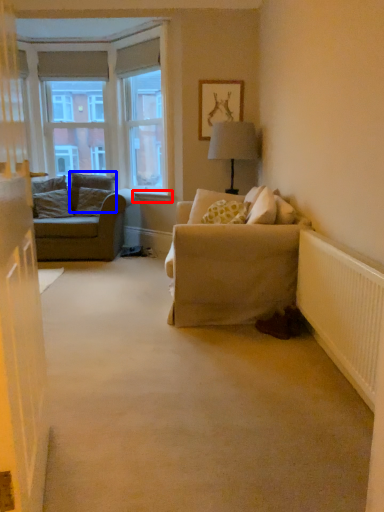
Question: Which object appears closest to the camera in this image, window sill (highlighted by a red box) or pillow (highlighted by a blue box)?

Choices:
 (A) window sill
 (B) pillow

Answer: (A)